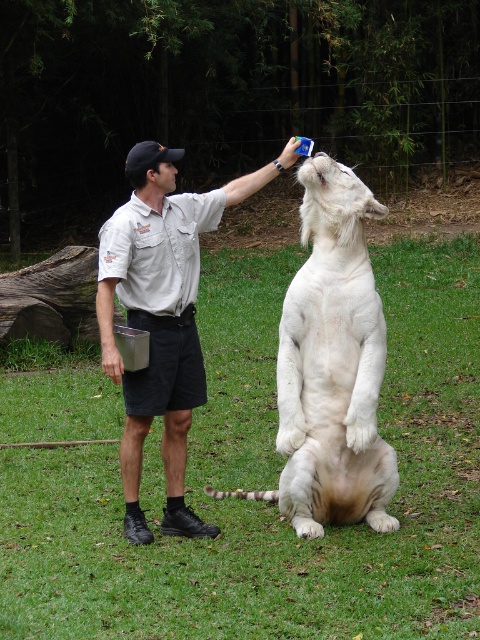
Question: Can you confirm if white fur tiger at center is thinner than light beige uniform at center?

Choices:
 (A) no
 (B) yes

Answer: (A)

Question: Considering the relative positions of white fur tiger at center and light beige uniform at center in the image provided, where is white fur tiger at center located with respect to light beige uniform at center?

Choices:
 (A) right
 (B) left

Answer: (A)

Question: Does white fur tiger at center have a larger size compared to light beige uniform at center?

Choices:
 (A) no
 (B) yes

Answer: (B)